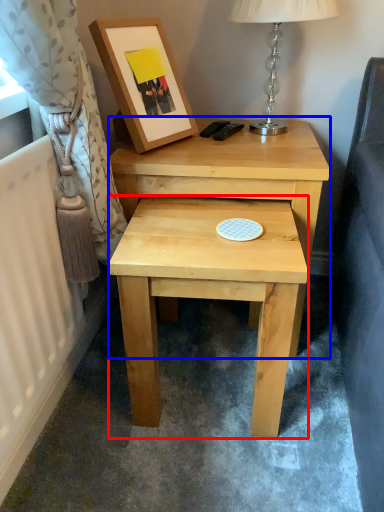
Question: Which of the following is the closest to the observer, stool (highlighted by a red box) or nightstand (highlighted by a blue box)?

Choices:
 (A) stool
 (B) nightstand

Answer: (A)